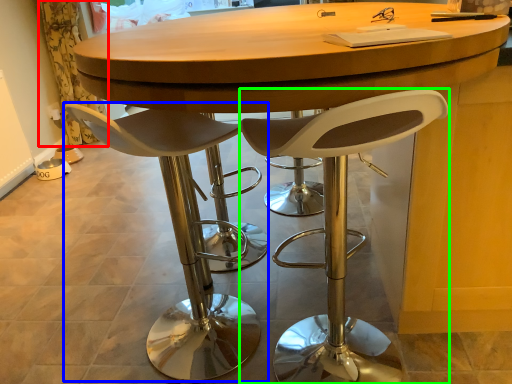
Question: Which is nearer to the curtain (highlighted by a red box)? chair (highlighted by a blue box) or chair (highlighted by a green box).

Choices:
 (A) chair
 (B) chair

Answer: (A)